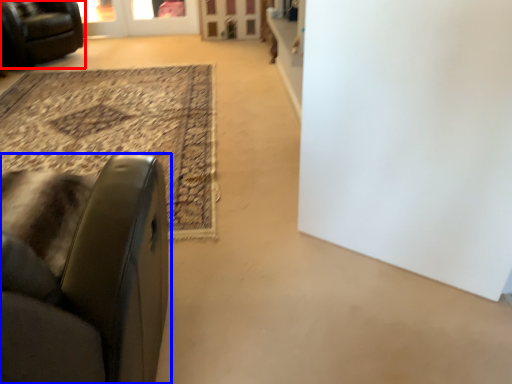
Question: Which of the following is the closest to the observer, chair (highlighted by a red box) or chair (highlighted by a blue box)?

Choices:
 (A) chair
 (B) chair

Answer: (B)